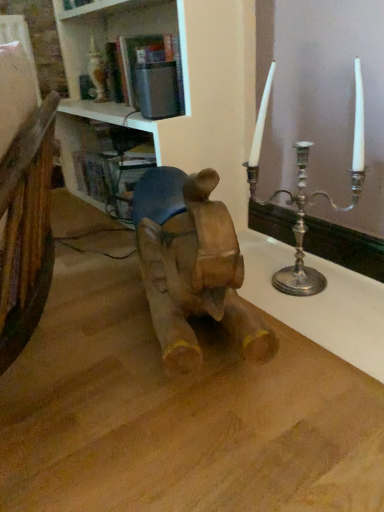
Question: Does silver metallic candlestick at upper right have a larger size compared to white glossy bookshelf at upper center?

Choices:
 (A) no
 (B) yes

Answer: (A)

Question: Does silver metallic candlestick at upper right have a lesser width compared to white glossy bookshelf at upper center?

Choices:
 (A) no
 (B) yes

Answer: (B)

Question: From the image's perspective, is silver metallic candlestick at upper right over white glossy bookshelf at upper center?

Choices:
 (A) no
 (B) yes

Answer: (A)

Question: Does silver metallic candlestick at upper right lie behind white glossy bookshelf at upper center?

Choices:
 (A) no
 (B) yes

Answer: (A)

Question: From a real-world perspective, is silver metallic candlestick at upper right below white glossy bookshelf at upper center?

Choices:
 (A) no
 (B) yes

Answer: (B)

Question: Is point (297, 224) positioned closer to the camera than point (66, 112)?

Choices:
 (A) farther
 (B) closer

Answer: (B)

Question: Is silver metallic candle holder at right in front of or behind white glossy bookshelf at upper center in the image?

Choices:
 (A) behind
 (B) front

Answer: (A)

Question: Would you say silver metallic candle holder at right is inside or outside white glossy bookshelf at upper center?

Choices:
 (A) inside
 (B) outside

Answer: (B)

Question: From the image's perspective, relative to white glossy bookshelf at upper center, is silver metallic candle holder at right above or below?

Choices:
 (A) below
 (B) above

Answer: (A)

Question: Based on their sizes in the image, would you say silver metallic candlestick at upper right is bigger or smaller than silver metallic candle holder at right?

Choices:
 (A) small
 (B) big

Answer: (B)

Question: From the image's perspective, is silver metallic candlestick at upper right located above or below silver metallic candle holder at right?

Choices:
 (A) above
 (B) below

Answer: (A)

Question: Visually, is silver metallic candlestick at upper right positioned to the left or to the right of silver metallic candle holder at right?

Choices:
 (A) right
 (B) left

Answer: (B)

Question: Is silver metallic candlestick at upper right situated inside silver metallic candle holder at right or outside?

Choices:
 (A) inside
 (B) outside

Answer: (B)

Question: From a real-world perspective, is silver metallic candlestick at upper right above or below white glossy bookshelf at upper center?

Choices:
 (A) below
 (B) above

Answer: (A)

Question: Is silver metallic candlestick at upper right spatially inside white glossy bookshelf at upper center, or outside of it?

Choices:
 (A) inside
 (B) outside

Answer: (B)